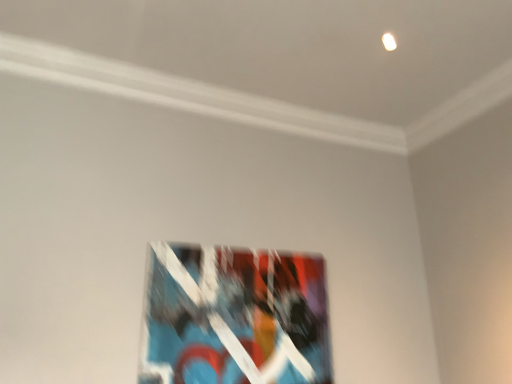
The height and width of the screenshot is (384, 512). What do you see at coordinates (234, 317) in the screenshot?
I see `matte plastic picture frame at center` at bounding box center [234, 317].

Where is `matte plastic picture frame at center`? matte plastic picture frame at center is located at coordinates (234, 317).

Consider the image. Measure the distance between matte plastic picture frame at center and camera.

matte plastic picture frame at center is 5.62 feet from camera.

The width and height of the screenshot is (512, 384). In order to click on matte plastic picture frame at center in this screenshot , I will do `click(234, 317)`.